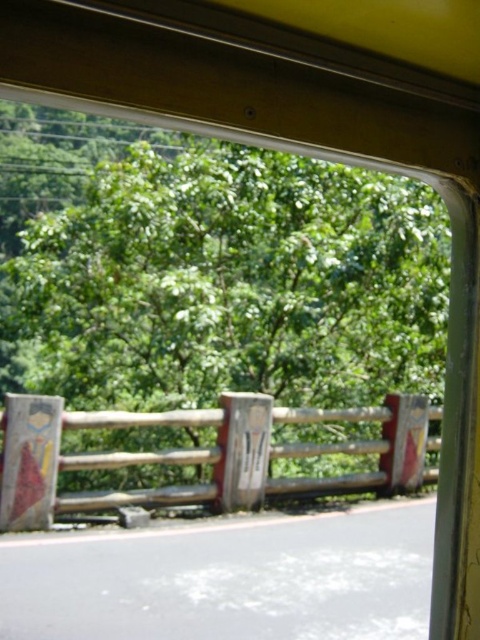
Question: Which point appears closest to the camera in this image?

Choices:
 (A) (333, 484)
 (B) (93, 408)

Answer: (B)

Question: Does green leafy tree at center appear under wooden fence at lower center?

Choices:
 (A) no
 (B) yes

Answer: (A)

Question: Can you confirm if green leafy tree at center is thinner than wooden fence at lower center?

Choices:
 (A) yes
 (B) no

Answer: (B)

Question: Can you confirm if green leafy tree at center is bigger than wooden fence at lower center?

Choices:
 (A) yes
 (B) no

Answer: (A)